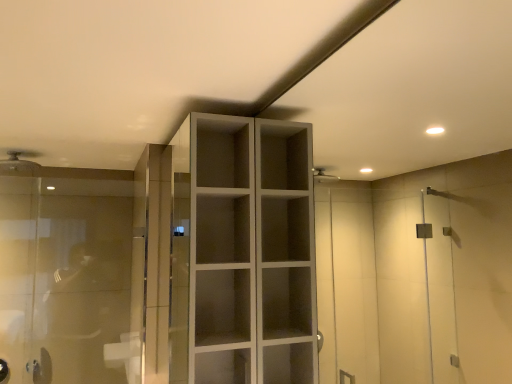
What are the coordinates of `empty space that is ontop of matte white shower head at upper left (from a real-world perspective)` in the screenshot? It's located at point(13,149).